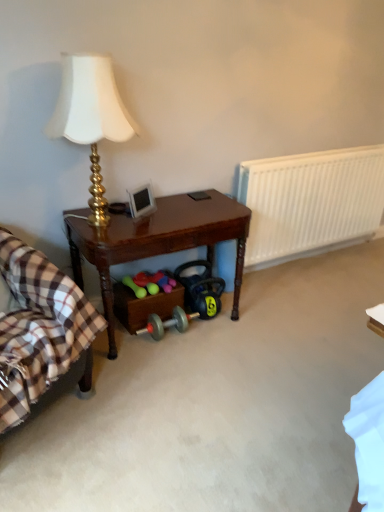
Question: From a real-world perspective, is brown wooden table at center below gold metallic lamp at upper left?

Choices:
 (A) yes
 (B) no

Answer: (A)

Question: Is brown wooden table at center in contact with gold metallic lamp at upper left?

Choices:
 (A) no
 (B) yes

Answer: (A)

Question: Considering the relative positions of brown wooden table at center and gold metallic lamp at upper left in the image provided, is brown wooden table at center to the right of gold metallic lamp at upper left from the viewer's perspective?

Choices:
 (A) no
 (B) yes

Answer: (B)

Question: Considering the relative sizes of brown wooden table at center and gold metallic lamp at upper left in the image provided, is brown wooden table at center smaller than gold metallic lamp at upper left?

Choices:
 (A) yes
 (B) no

Answer: (B)

Question: From a real-world perspective, is brown wooden table at center on gold metallic lamp at upper left?

Choices:
 (A) no
 (B) yes

Answer: (A)

Question: Does brown wooden table at center lie in front of gold metallic lamp at upper left?

Choices:
 (A) no
 (B) yes

Answer: (A)

Question: Can you confirm if white plastic radiator at right is taller than brown wooden table at center?

Choices:
 (A) no
 (B) yes

Answer: (B)

Question: Is white plastic radiator at right closer to camera compared to brown wooden table at center?

Choices:
 (A) no
 (B) yes

Answer: (A)

Question: Does white plastic radiator at right appear on the left side of brown wooden table at center?

Choices:
 (A) no
 (B) yes

Answer: (A)

Question: Can you confirm if white plastic radiator at right is thinner than brown wooden table at center?

Choices:
 (A) no
 (B) yes

Answer: (B)

Question: Is white plastic radiator at right touching brown wooden table at center?

Choices:
 (A) no
 (B) yes

Answer: (A)

Question: Are white plastic radiator at right and brown wooden table at center far apart?

Choices:
 (A) yes
 (B) no

Answer: (B)

Question: Is the position of white plastic radiator at right more distant than that of gold metallic lamp at upper left?

Choices:
 (A) no
 (B) yes

Answer: (B)